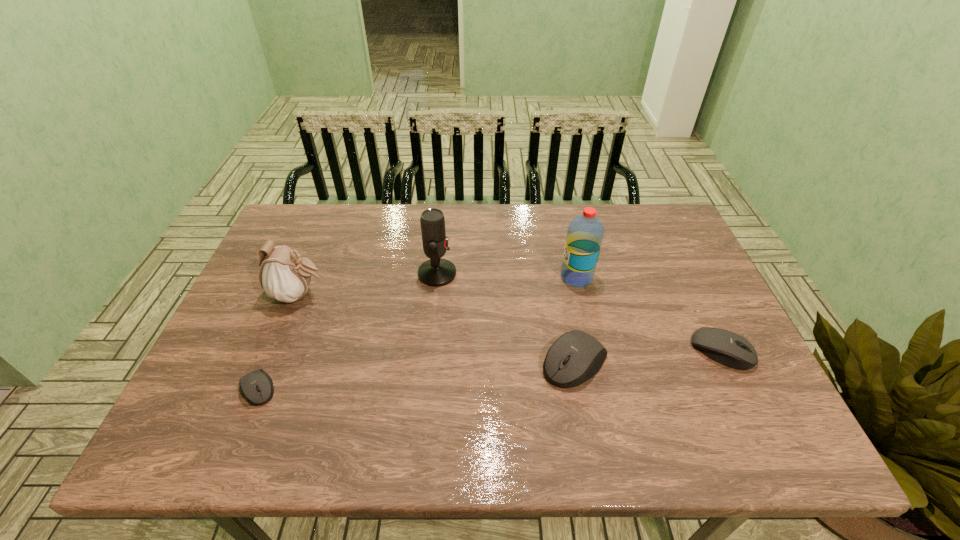
At what (x,y) coordinates should I click in order to perform the action: click on free space in the image that satisfies the following two spatial constraints: 1. on the front label of the water bottle; 2. on the left side of the rightmost computer equipment. Please return your answer as a coordinate pair (x, y). This screenshot has height=540, width=960. Looking at the image, I should click on (593, 350).